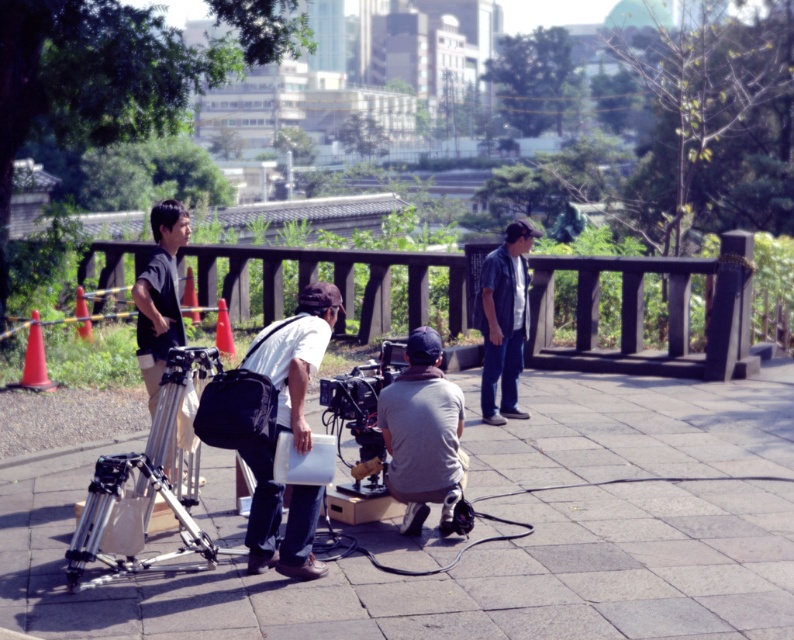
You are a crew member who needs to place a 1.2 meter tall prop next to the white matte shirt at center and the silver metallic tripod at lower left. Which object should the prop be placed next to so that it doesn

The white matte shirt at center is much taller than the silver metallic tripod at lower left, so the prop should be placed next to the white matte shirt at center to ensure proper visibility and balance in the scene.

You are a costume designer observing the film crew setup. You need to determine if the white matte shirt at center can be worn over the silver metallic tripod at lower left. Based on their sizes, what do you think?

The white matte shirt at center is narrower than the silver metallic tripod at lower left, so it cannot be worn over the tripod since it is not wide enough to cover it.

You are a crew member carrying a heavy equipment box. You need to place it on the brown wooden rail at center without blocking the silver metallic tripod at lower left. Is the rail closer to you than the tripod?

The brown wooden rail at center is further to the viewer than the silver metallic tripod at lower left, so placing the equipment box on the rail would not block the tripod since the rail is farther away.